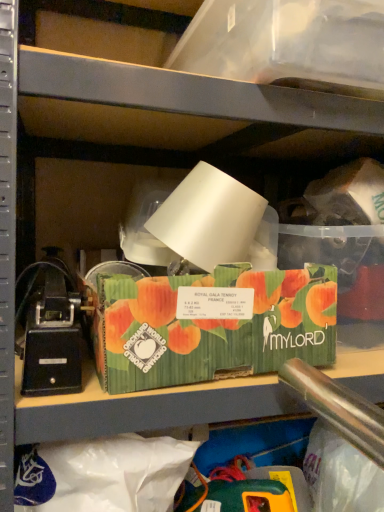
Question: Which direction should I rotate to look at transparent plastic storage box at upper center, the 1th storage box in the top-to-bottom sequence?

Choices:
 (A) right
 (B) left

Answer: (A)

Question: Is transparent plastic storage box at upper center, the 2th storage box in the bottom-to-top sequence, to the left of black plastic toy at left from the viewer's perspective?

Choices:
 (A) no
 (B) yes

Answer: (A)

Question: Can we say transparent plastic storage box at upper center, the 2th storage box in the bottom-to-top sequence, lies outside black plastic toy at left?

Choices:
 (A) yes
 (B) no

Answer: (A)

Question: From the image's perspective, is transparent plastic storage box at upper center, the 1th storage box in the top-to-bottom sequence, located beneath black plastic toy at left?

Choices:
 (A) yes
 (B) no

Answer: (B)

Question: Is black plastic toy at left a part of transparent plastic storage box at upper center, the 2th storage box in the bottom-to-top sequence?

Choices:
 (A) yes
 (B) no

Answer: (B)

Question: Can you confirm if transparent plastic storage box at upper center, the 1th storage box in the top-to-bottom sequence, is wider than black plastic toy at left?

Choices:
 (A) no
 (B) yes

Answer: (B)

Question: From a real-world perspective, is transparent plastic storage box at upper center, the 1th storage box in the top-to-bottom sequence, positioned over black plastic toy at left based on gravity?

Choices:
 (A) yes
 (B) no

Answer: (A)

Question: Is green corrugated cardboard box at center, the second storage box from the top, far away from transparent plastic storage box at upper center, the 2th storage box in the bottom-to-top sequence?

Choices:
 (A) yes
 (B) no

Answer: (B)

Question: From a real-world perspective, does green corrugated cardboard box at center, arranged as the 1th storage box when ordered from the bottom, sit lower than transparent plastic storage box at upper center, the 2th storage box in the bottom-to-top sequence?

Choices:
 (A) no
 (B) yes

Answer: (B)

Question: Is green corrugated cardboard box at center, arranged as the 1th storage box when ordered from the bottom, aimed at transparent plastic storage box at upper center, the 1th storage box in the top-to-bottom sequence?

Choices:
 (A) no
 (B) yes

Answer: (A)

Question: Is green corrugated cardboard box at center, arranged as the 1th storage box when ordered from the bottom, positioned beyond the bounds of transparent plastic storage box at upper center, the 2th storage box in the bottom-to-top sequence?

Choices:
 (A) no
 (B) yes

Answer: (B)

Question: Does green corrugated cardboard box at center, the second storage box from the top, have a lesser width compared to transparent plastic storage box at upper center, the 2th storage box in the bottom-to-top sequence?

Choices:
 (A) no
 (B) yes

Answer: (B)

Question: Considering the relative sizes of green corrugated cardboard box at center, the second storage box from the top, and transparent plastic storage box at upper center, the 1th storage box in the top-to-bottom sequence, in the image provided, is green corrugated cardboard box at center, the second storage box from the top, bigger than transparent plastic storage box at upper center, the 1th storage box in the top-to-bottom sequence,?

Choices:
 (A) no
 (B) yes

Answer: (A)

Question: Is there a large distance between transparent plastic storage box at upper center, the 1th storage box in the top-to-bottom sequence, and green corrugated cardboard box at center, the second storage box from the top?

Choices:
 (A) no
 (B) yes

Answer: (A)